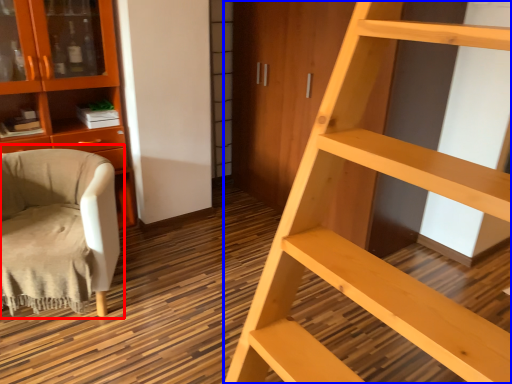
Question: Which object appears closest to the camera in this image, chair (highlighted by a red box) or ladder (highlighted by a blue box)?

Choices:
 (A) chair
 (B) ladder

Answer: (B)